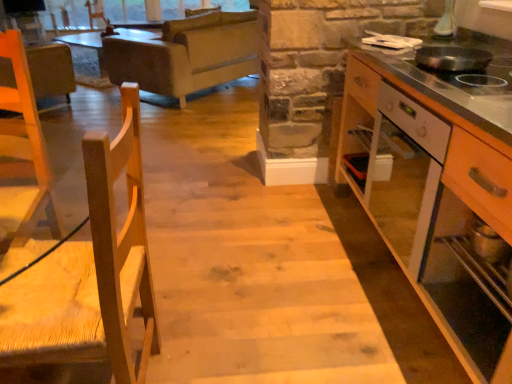
Measure the distance between black matte pan at upper right and camera.

black matte pan at upper right is 1.23 meters from camera.

What do you see at coordinates (51, 70) in the screenshot? I see `brown leather armchair at upper left` at bounding box center [51, 70].

What are the coordinates of `black matte pan at upper right` in the screenshot? It's located at (464, 68).

Is point (509, 61) in front of point (137, 175)?

No.

Can natural wood chair at left be found inside black matte pan at upper right?

No, natural wood chair at left is not a part of black matte pan at upper right.

From the picture: From the image's perspective, which is above, black matte pan at upper right or natural wood chair at left?

black matte pan at upper right appears higher in the image.

Which of these two, black matte pan at upper right or natural wood chair at left, is smaller?

Smaller between the two is black matte pan at upper right.

From a real-world perspective, who is located higher, brown leather armchair at upper left or black matte pan at upper right?

black matte pan at upper right is physically above.

Which object is wider, brown leather armchair at upper left or black matte pan at upper right?

Wider between the two is brown leather armchair at upper left.

Looking at this image, is brown leather armchair at upper left far from black matte pan at upper right?

Indeed, brown leather armchair at upper left is not near black matte pan at upper right.

Is wooden cabinet at right shorter than black matte pan at upper right?

No.

Is wooden cabinet at right further to camera compared to black matte pan at upper right?

No.

Is wooden cabinet at right positioned with its back to black matte pan at upper right?

wooden cabinet at right does not have its back to black matte pan at upper right.

Can you confirm if wooden cabinet at right is positioned to the right of black matte pan at upper right?

Correct, you'll find wooden cabinet at right to the right of black matte pan at upper right.

Does point (379, 141) appear closer or farther from the camera than point (220, 45)?

Point (379, 141) is closer to the camera than point (220, 45).

Identify the location of cabinetry on the right of light gray fabric couch at upper center. (434, 205).

Choose the correct answer: Is wooden cabinet at right inside light gray fabric couch at upper center or outside it?

The correct answer is: outside.

Can you tell me how much wooden cabinet at right and light gray fabric couch at upper center differ in facing direction?

They differ by 42.3 degrees in their facing directions.

Which point is more distant from viewer, (x=69, y=245) or (x=457, y=243)?

The point (x=457, y=243) is farther.

Does natural wood chair at left have a larger size compared to wooden cabinet at right?

No.

Which object is closer to the camera, natural wood chair at left or wooden cabinet at right?

wooden cabinet at right.

Who is taller, natural wood chair at left or wooden cabinet at right?

With more height is natural wood chair at left.

Which of these two, brown leather armchair at upper left or light gray fabric couch at upper center, is wider?

light gray fabric couch at upper center.

Locate an element on the screen. The height and width of the screenshot is (384, 512). studio couch above the brown leather armchair at upper left (from a real-world perspective) is located at coordinates (187, 54).

What's the angular difference between brown leather armchair at upper left and light gray fabric couch at upper center's facing directions?

92.4 degrees separate the facing orientations of brown leather armchair at upper left and light gray fabric couch at upper center.

Does brown leather armchair at upper left touch light gray fabric couch at upper center?

They are not placed beside each other.

Are light gray fabric couch at upper center and wooden cabinet at right making contact?

No.

In the image, there is a light gray fabric couch at upper center. What are the coordinates of `cabinetry below it (from the image's perspective)` in the screenshot? It's located at (434, 205).

In terms of size, does light gray fabric couch at upper center appear bigger or smaller than wooden cabinet at right?

In the image, light gray fabric couch at upper center appears to be larger than wooden cabinet at right.

Considering the positions of objects light gray fabric couch at upper center and wooden cabinet at right in the image provided, who is behind, light gray fabric couch at upper center or wooden cabinet at right?

light gray fabric couch at upper center is further from the camera.

Where is `chair located on the left of black matte pan at upper right`? The image size is (512, 384). chair located on the left of black matte pan at upper right is located at coordinates (90, 272).

The image size is (512, 384). I want to click on armchair behind the black matte pan at upper right, so click(x=51, y=70).

Looking at the image, which one is located further to black matte pan at upper right, light gray fabric couch at upper center or brown leather armchair at upper left?

The object further to black matte pan at upper right is brown leather armchair at upper left.

When comparing their distances from brown leather armchair at upper left, does natural wood chair at left or black matte pan at upper right seem further?

Based on the image, black matte pan at upper right appears to be further to brown leather armchair at upper left.

Which object lies nearer to the anchor point natural wood chair at left, black matte pan at upper right or wooden cabinet at right?

The object closer to natural wood chair at left is wooden cabinet at right.

When comparing their distances from wooden cabinet at right, does black matte pan at upper right or light gray fabric couch at upper center seem further?

light gray fabric couch at upper center is positioned further to the anchor wooden cabinet at right.

Estimate the real-world distances between objects in this image. Which object is further from wooden cabinet at right, brown leather armchair at upper left or light gray fabric couch at upper center?

brown leather armchair at upper left is further to wooden cabinet at right.

When comparing their distances from natural wood chair at left, does light gray fabric couch at upper center or black matte pan at upper right seem closer?

The object closer to natural wood chair at left is black matte pan at upper right.

Based on their spatial positions, is black matte pan at upper right or natural wood chair at left further from light gray fabric couch at upper center?

Based on the image, natural wood chair at left appears to be further to light gray fabric couch at upper center.

Considering their positions, is brown leather armchair at upper left positioned further to natural wood chair at left than light gray fabric couch at upper center?

Among the two, brown leather armchair at upper left is located further to natural wood chair at left.

Image resolution: width=512 pixels, height=384 pixels. Find the location of `chair located between brown leather armchair at upper left and black matte pan at upper right in the left-right direction`. chair located between brown leather armchair at upper left and black matte pan at upper right in the left-right direction is located at coordinates (90, 272).

Locate an element on the screen. studio couch between brown leather armchair at upper left and black matte pan at upper right from left to right is located at coordinates (187, 54).

Find the location of a particular element. The height and width of the screenshot is (384, 512). armchair between natural wood chair at left and light gray fabric couch at upper center along the z-axis is located at coordinates (51, 70).

At what (x,y) coordinates should I click in order to perform the action: click on gas stove between wooden cabinet at right and light gray fabric couch at upper center in the front-back direction. Please return your answer as a coordinate pair (x, y). Image resolution: width=512 pixels, height=384 pixels. Looking at the image, I should click on (464, 68).